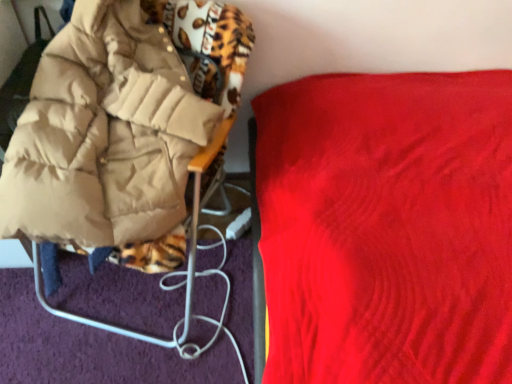
Question: Does point (398, 354) appear closer or farther from the camera than point (133, 117)?

Choices:
 (A) closer
 (B) farther

Answer: (A)

Question: In terms of height, does velvet red blanket at upper right, placed as the 1th furniture when sorted from right to left, look taller or shorter compared to matte beige jacket at left, positioned as the 1th furniture in left-to-right order?

Choices:
 (A) short
 (B) tall

Answer: (B)

Question: From a real-world perspective, is velvet red blanket at upper right, positioned as the 2th furniture in left-to-right order, physically located above or below matte beige jacket at left, arranged as the 2th furniture when viewed from the right?

Choices:
 (A) below
 (B) above

Answer: (B)

Question: Considering the positions of matte beige jacket at left, positioned as the 1th furniture in left-to-right order, and velvet red blanket at upper right, positioned as the 2th furniture in left-to-right order, in the image, is matte beige jacket at left, positioned as the 1th furniture in left-to-right order, bigger or smaller than velvet red blanket at upper right, positioned as the 2th furniture in left-to-right order,?

Choices:
 (A) small
 (B) big

Answer: (A)

Question: Is matte beige jacket at left, arranged as the 2th furniture when viewed from the right, taller or shorter than velvet red blanket at upper right, positioned as the 2th furniture in left-to-right order?

Choices:
 (A) short
 (B) tall

Answer: (A)

Question: Does point (123, 251) appear closer or farther from the camera than point (490, 357)?

Choices:
 (A) closer
 (B) farther

Answer: (B)

Question: Relative to velvet red blanket at upper right, placed as the 1th furniture when sorted from right to left, is matte beige jacket at left, arranged as the 2th furniture when viewed from the right, in front or behind?

Choices:
 (A) behind
 (B) front

Answer: (A)